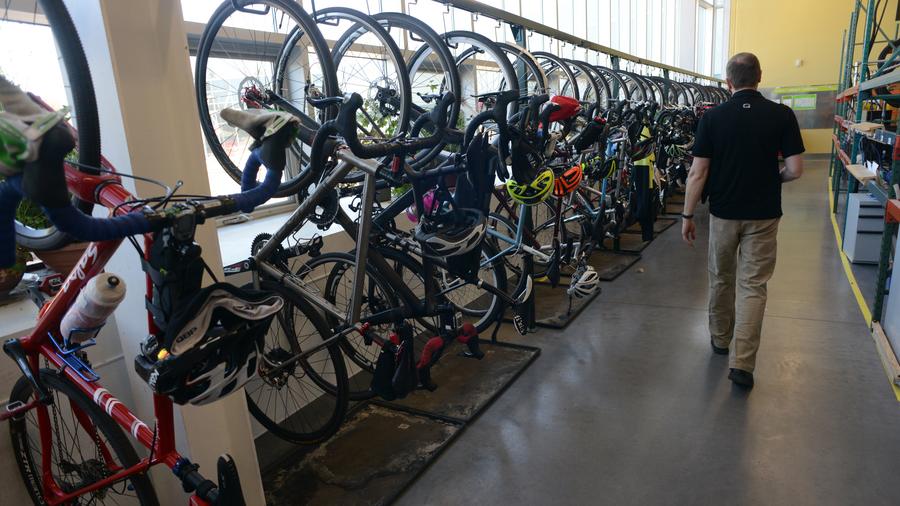
Image resolution: width=900 pixels, height=506 pixels. Identify the location of wall. (788, 56).